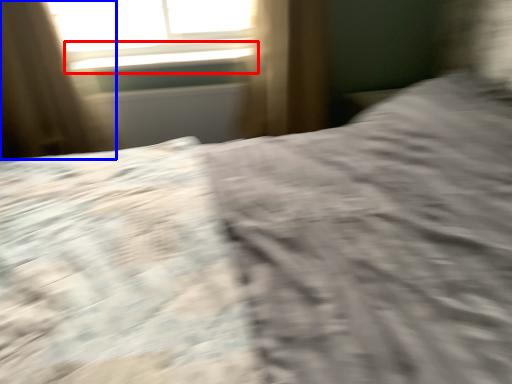
Question: Among these objects, which one is nearest to the camera, window sill (highlighted by a red box) or curtain (highlighted by a blue box)?

Choices:
 (A) window sill
 (B) curtain

Answer: (B)